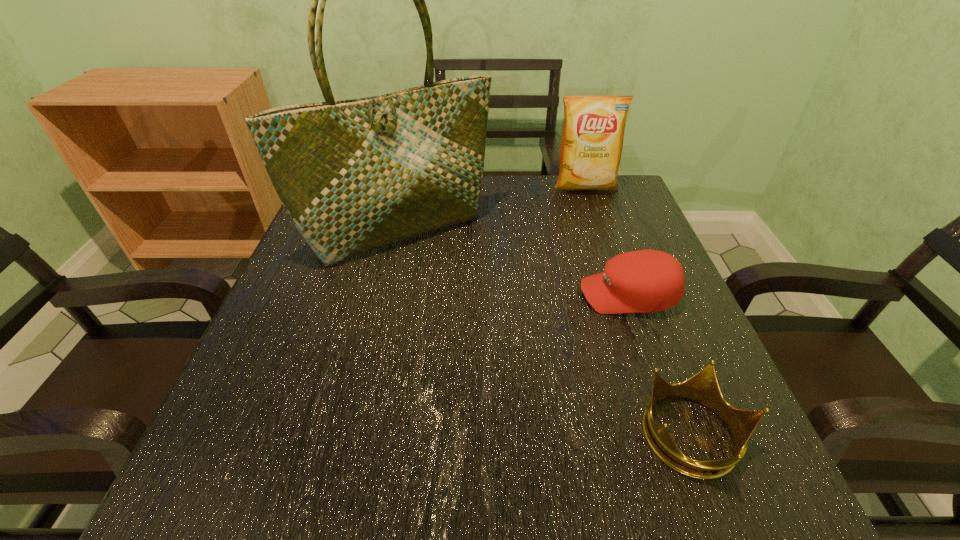
The width and height of the screenshot is (960, 540). What are the coordinates of `free region located on the front-facing side of the cap` in the screenshot? It's located at (554, 295).

Locate an element on the screen. vacant space positioned on the left of the crown is located at coordinates (389, 436).

This screenshot has width=960, height=540. Find the location of `shopping bag that is at the far edge`. shopping bag that is at the far edge is located at coordinates (355, 175).

This screenshot has width=960, height=540. Find the location of `crisp (potato chip) that is at the far edge`. crisp (potato chip) that is at the far edge is located at coordinates (593, 132).

Where is `object at the near edge`? object at the near edge is located at coordinates (703, 387).

In order to click on object at the left edge in this screenshot , I will do `click(355, 175)`.

What are the coordinates of `crisp (potato chip) located in the right edge section of the desktop` in the screenshot? It's located at (593, 132).

Where is `cap located in the right edge section of the desktop`? Image resolution: width=960 pixels, height=540 pixels. cap located in the right edge section of the desktop is located at coordinates (644, 281).

What are the coordinates of `crown that is at the right edge` in the screenshot? It's located at coord(703,387).

Image resolution: width=960 pixels, height=540 pixels. Find the location of `object that is at the far left corner`. object that is at the far left corner is located at coordinates click(x=355, y=175).